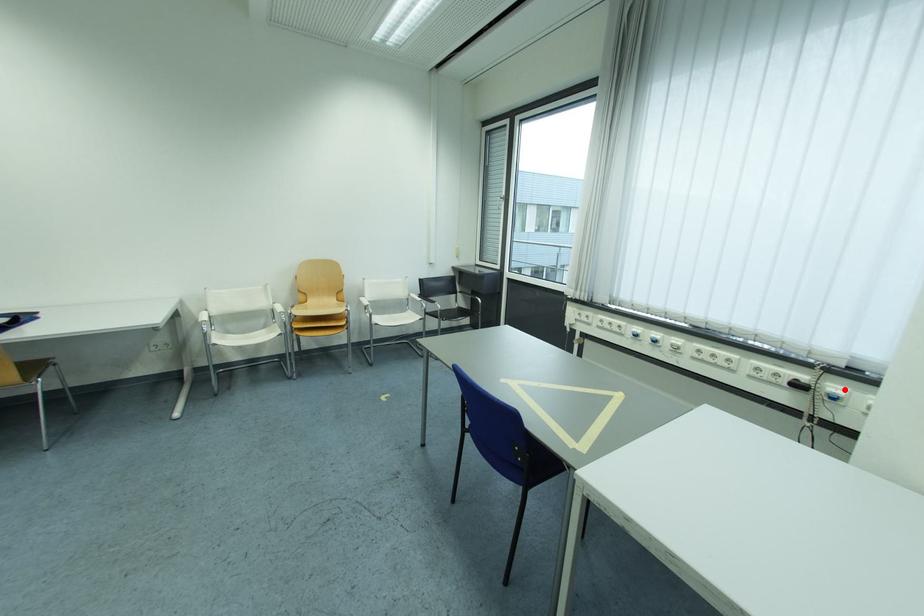
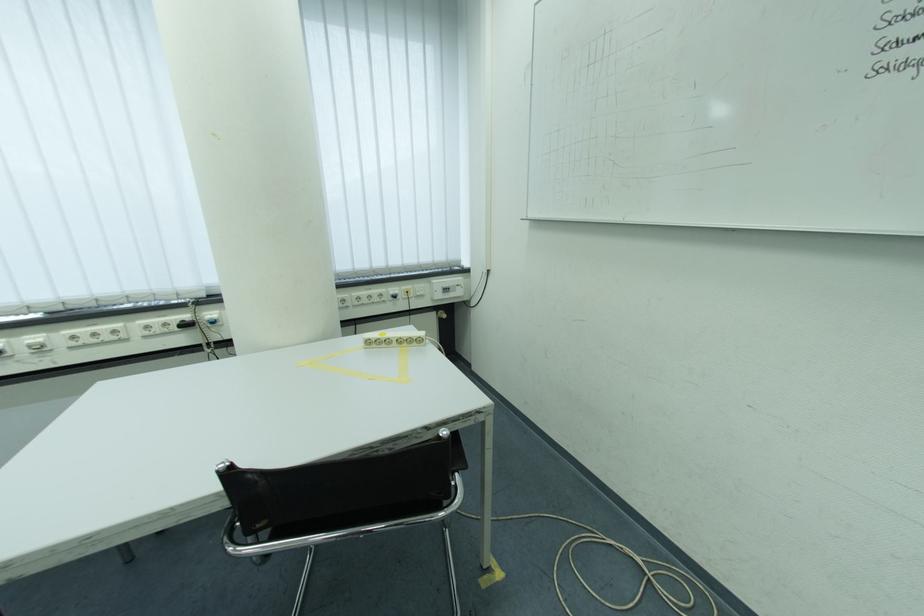
In the second image, find the point that corresponds to the highlighted location in the first image.

(217, 315)